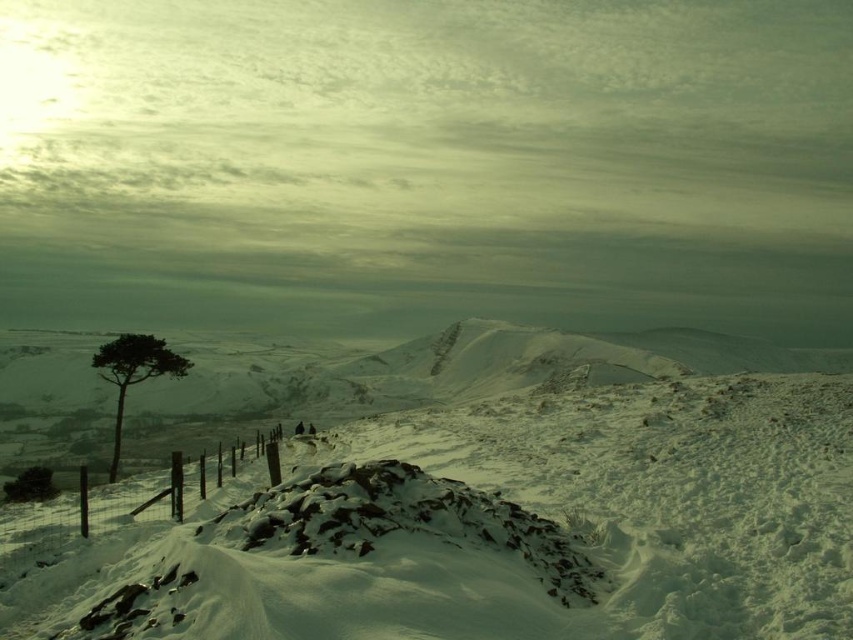
Question: Does white powdery snow at center come behind green leafy tree at left?

Choices:
 (A) yes
 (B) no

Answer: (B)

Question: Is white powdery snow at center to the right of wooden post fence at lower left from the viewer's perspective?

Choices:
 (A) no
 (B) yes

Answer: (B)

Question: Which point is farther to the camera?

Choices:
 (A) pos(105,524)
 (B) pos(299,556)
 (C) pos(148,346)

Answer: (C)

Question: Which of the following is the closest to the observer?

Choices:
 (A) (614, 344)
 (B) (126, 352)
 (C) (27, 529)

Answer: (C)

Question: Which object appears closest to the camera in this image?

Choices:
 (A) wooden post fence at lower left
 (B) green leafy tree at left

Answer: (A)

Question: Is wooden post fence at lower left positioned before green leafy tree at left?

Choices:
 (A) yes
 (B) no

Answer: (A)